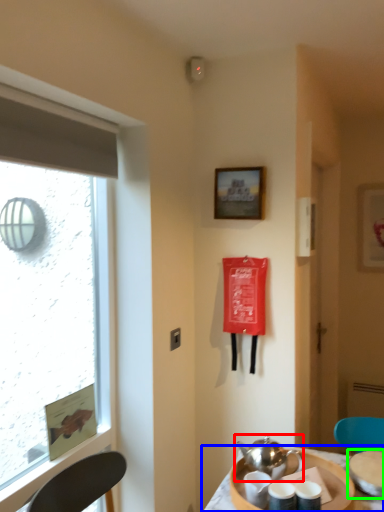
Question: Which is nearer to the tea set (highlighted by a red box)? table (highlighted by a blue box) or tableware (highlighted by a green box).

Choices:
 (A) table
 (B) tableware

Answer: (A)